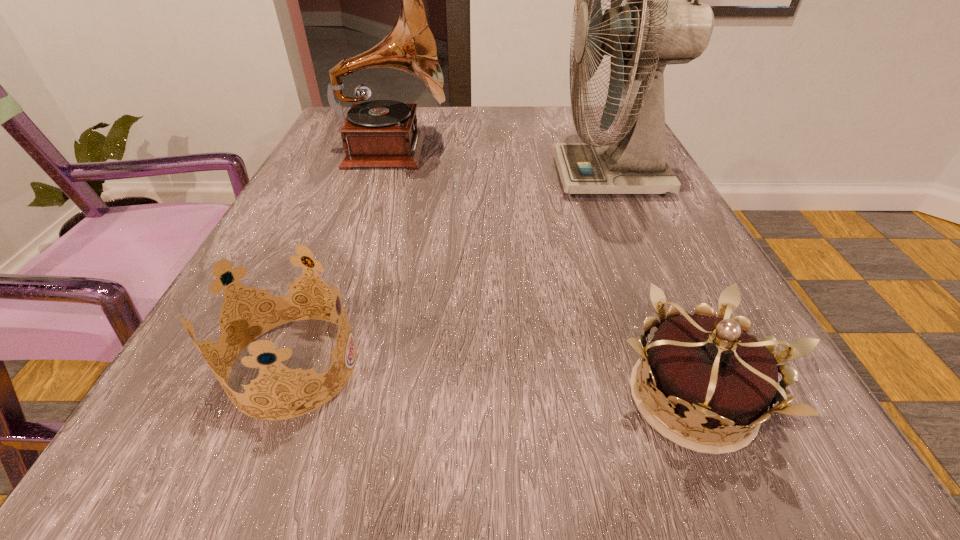
Where is `unoccupied position between the second tallest object and the right crown`? unoccupied position between the second tallest object and the right crown is located at coordinates (542, 275).

Select which object appears as the third closest to the second tallest object. Please provide its 2D coordinates. Your answer should be formatted as a tuple, i.e. [(x, y)], where the tuple contains the x and y coordinates of a point satisfying the conditions above.

[(708, 369)]

Locate which object ranks second in proximity to the phonograph_record. Please provide its 2D coordinates. Your answer should be formatted as a tuple, i.e. [(x, y)], where the tuple contains the x and y coordinates of a point satisfying the conditions above.

[(231, 303)]

Find the location of a particular element. The image size is (960, 540). vacant area that satisfies the following two spatial constraints: 1. on the back side of the right crown; 2. on the horn of the second tallest object is located at coordinates (591, 152).

In order to click on blank area in the image that satisfies the following two spatial constraints: 1. on the horn of the right crown; 2. on the right side of the third shortest object in this screenshot , I will do click(316, 398).

This screenshot has width=960, height=540. I want to click on free space that satisfies the following two spatial constraints: 1. on the front side of the left crown; 2. on the left side of the right crown, so click(x=281, y=398).

The image size is (960, 540). I want to click on vacant space that satisfies the following two spatial constraints: 1. on the front side of the left crown; 2. on the right side of the right crown, so click(281, 398).